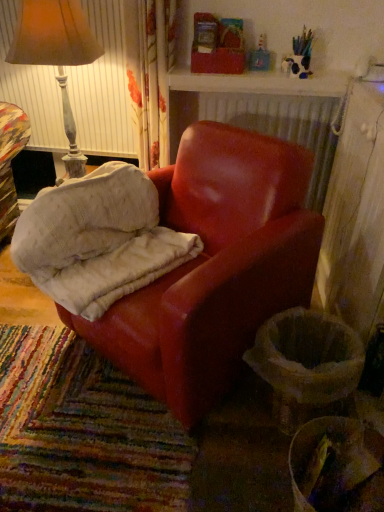
Locate an element on the screen. matte leather chair at center is located at coordinates (216, 267).

Does suede-like red armchair at center touch matte brown lampshade at upper left?

suede-like red armchair at center and matte brown lampshade at upper left are not in contact.

From the picture: Would you say suede-like red armchair at center is inside or outside matte brown lampshade at upper left?

suede-like red armchair at center exists outside the volume of matte brown lampshade at upper left.

Identify the location of lamp on the left of suede-like red armchair at center. click(x=56, y=54).

Based on the photo, is matte brown lampshade at upper left positioned far away from matte leather chair at center?

Actually, matte brown lampshade at upper left and matte leather chair at center are a little close together.

From a real-world perspective, which is physically above, matte brown lampshade at upper left or matte leather chair at center?

In real-world perspective, matte brown lampshade at upper left is above.

Can you confirm if matte brown lampshade at upper left is bigger than matte leather chair at center?

No, matte brown lampshade at upper left is not bigger than matte leather chair at center.

Does matte brown lampshade at upper left turn towards matte leather chair at center?

No, matte brown lampshade at upper left is not aimed at matte leather chair at center.

Between point (28, 59) and point (123, 232), which one is positioned in front?

The point (123, 232) is in front.

Which object is further away from the camera taking this photo, matte brown lampshade at upper left or suede-like red armchair at center?

Positioned behind is matte brown lampshade at upper left.

Is matte brown lampshade at upper left bigger than suede-like red armchair at center?

No, matte brown lampshade at upper left is not bigger than suede-like red armchair at center.

From a real-world perspective, does matte brown lampshade at upper left stand above suede-like red armchair at center?

Indeed, from a real-world perspective, matte brown lampshade at upper left stands above suede-like red armchair at center.

In the scene shown: Is matte brown lampshade at upper left located within matte leather chair at center?

No.

From the image's perspective, is matte leather chair at center located above or below matte brown lampshade at upper left?

Based on their image positions, matte leather chair at center is located beneath matte brown lampshade at upper left.

Considering the sizes of objects matte leather chair at center and matte brown lampshade at upper left in the image provided, who is bigger, matte leather chair at center or matte brown lampshade at upper left?

Bigger between the two is matte leather chair at center.

I want to click on chair that appears below the matte brown lampshade at upper left (from a real-world perspective), so click(x=216, y=267).

Where is `chair below the suede-like red armchair at center (from the image's perspective)`? chair below the suede-like red armchair at center (from the image's perspective) is located at coordinates (216, 267).

Is suede-like red armchair at center oriented towards matte leather chair at center?

Yes, suede-like red armchair at center is facing matte leather chair at center.

Considering the relative sizes of suede-like red armchair at center and matte leather chair at center in the image provided, is suede-like red armchair at center taller than matte leather chair at center?

No, suede-like red armchair at center is not taller than matte leather chair at center.

Can you tell me how much matte leather chair at center and suede-like red armchair at center differ in facing direction?

2.74 degrees separate the facing orientations of matte leather chair at center and suede-like red armchair at center.

From a real-world perspective, which object stands above the other?

A: suede-like red armchair at center, from a real-world perspective.

The width and height of the screenshot is (384, 512). What are the coordinates of `material on the left of matte leather chair at center` in the screenshot? It's located at (97, 241).

From the image's perspective, does matte leather chair at center appear higher than suede-like red armchair at center?

No, from the image's perspective, matte leather chair at center is not on top of suede-like red armchair at center.

Find the location of a particular element. This screenshot has height=512, width=384. material that is on the right side of matte brown lampshade at upper left is located at coordinates (97, 241).

Find the location of a particular element. lamp above the matte leather chair at center (from a real-world perspective) is located at coordinates (56, 54).

Which object lies nearer to the anchor point suede-like red armchair at center, matte leather chair at center or matte brown lampshade at upper left?

matte leather chair at center is positioned closer to the anchor suede-like red armchair at center.

Looking at the image, which one is located closer to matte brown lampshade at upper left, matte leather chair at center or suede-like red armchair at center?

Based on the image, suede-like red armchair at center appears to be nearer to matte brown lampshade at upper left.

From the image, which object appears to be nearer to suede-like red armchair at center, matte brown lampshade at upper left or matte leather chair at center?

matte leather chair at center is closer to suede-like red armchair at center.

From the image, which object appears to be nearer to matte leather chair at center, suede-like red armchair at center or matte brown lampshade at upper left?

Based on the image, suede-like red armchair at center appears to be nearer to matte leather chair at center.

Estimate the real-world distances between objects in this image. Which object is further from matte leather chair at center, matte brown lampshade at upper left or suede-like red armchair at center?

matte brown lampshade at upper left lies further to matte leather chair at center than the other object.

Considering their positions, is suede-like red armchair at center positioned further to matte brown lampshade at upper left than matte leather chair at center?

Based on the image, matte leather chair at center appears to be further to matte brown lampshade at upper left.

Where is `material that lies between matte brown lampshade at upper left and matte leather chair at center from top to bottom`? The width and height of the screenshot is (384, 512). material that lies between matte brown lampshade at upper left and matte leather chair at center from top to bottom is located at coordinates (97, 241).